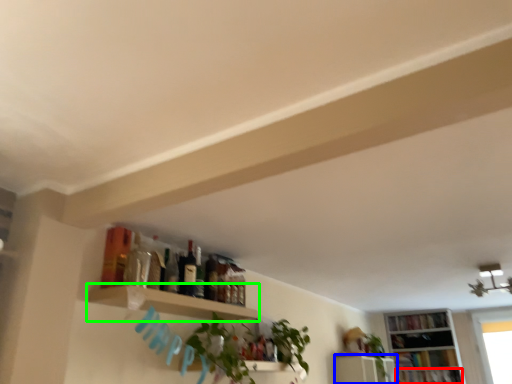
Question: Considering the real-world distances, which object is farthest from book (highlighted by a red box)? shelf (highlighted by a blue box) or shelf (highlighted by a green box)?

Choices:
 (A) shelf
 (B) shelf

Answer: (B)